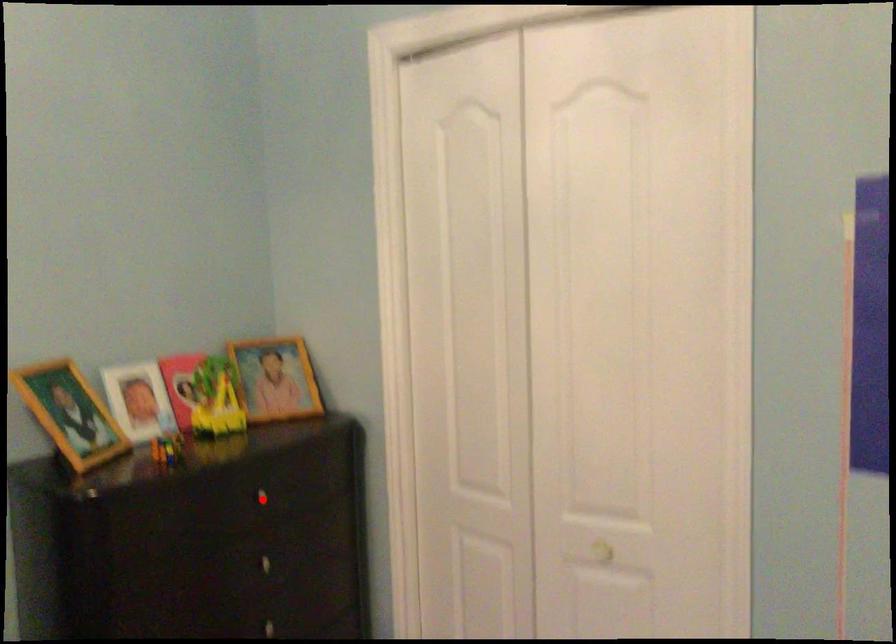
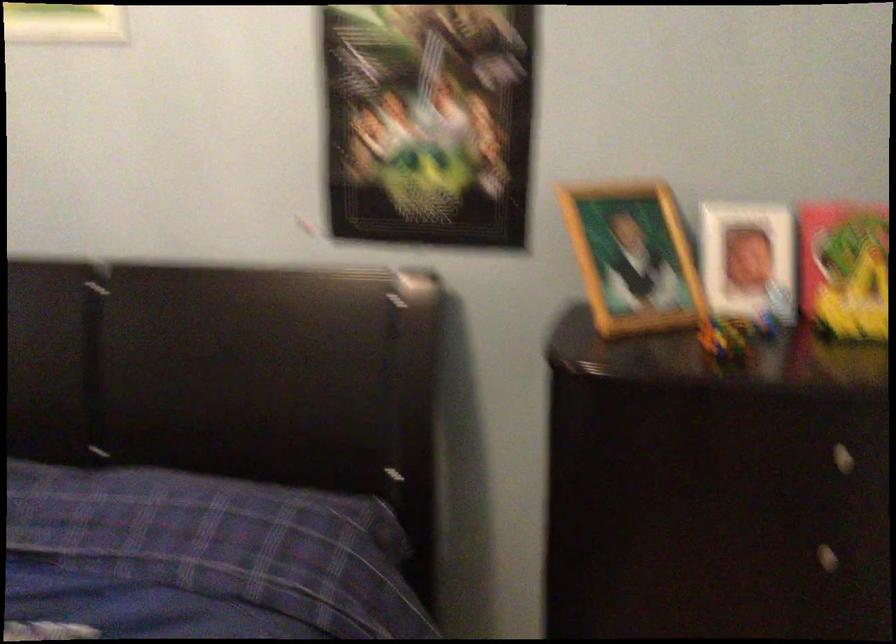
Question: I am providing you with two images of the same scene from different viewpoints. Image1 has a red point marked. In image2, the corresponding 3D location appears at what relative position? Reply with the corresponding letter.

Choices:
 (A) Closer
 (B) Farther

Answer: (A)